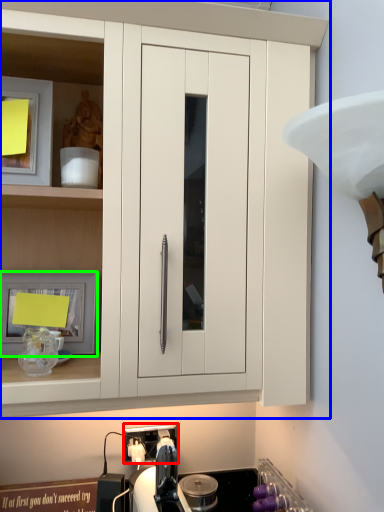
Question: Which object is positioned farthest from electric outlet (highlighted by a red box)? Select from cabinetry (highlighted by a blue box) and picture frame (highlighted by a green box).

Choices:
 (A) cabinetry
 (B) picture frame

Answer: (A)